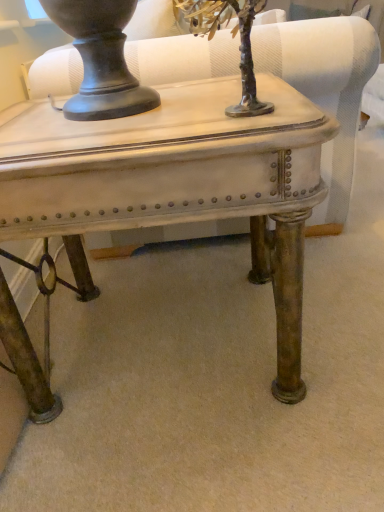
Question: Is the depth of matte white table at center greater than that of metallic silver tree at upper center?

Choices:
 (A) no
 (B) yes

Answer: (B)

Question: Considering the relative sizes of matte white table at center and metallic silver tree at upper center in the image provided, is matte white table at center wider than metallic silver tree at upper center?

Choices:
 (A) yes
 (B) no

Answer: (A)

Question: Can you see matte white table at center touching metallic silver tree at upper center?

Choices:
 (A) no
 (B) yes

Answer: (A)

Question: Considering the relative sizes of matte white table at center and metallic silver tree at upper center in the image provided, is matte white table at center taller than metallic silver tree at upper center?

Choices:
 (A) no
 (B) yes

Answer: (B)

Question: Is matte white table at center facing away from metallic silver tree at upper center?

Choices:
 (A) yes
 (B) no

Answer: (B)

Question: Would you say metallic silver tree at upper center is part of matte white table at center's contents?

Choices:
 (A) yes
 (B) no

Answer: (B)

Question: From the image's perspective, does metallic silver tree at upper center appear lower than matte white swivel chair at center?

Choices:
 (A) no
 (B) yes

Answer: (B)

Question: Considering the relative sizes of metallic silver tree at upper center and matte white swivel chair at center in the image provided, is metallic silver tree at upper center smaller than matte white swivel chair at center?

Choices:
 (A) no
 (B) yes

Answer: (B)

Question: Can you confirm if metallic silver tree at upper center is bigger than matte white swivel chair at center?

Choices:
 (A) no
 (B) yes

Answer: (A)

Question: Is metallic silver tree at upper center positioned with its back to matte white swivel chair at center?

Choices:
 (A) no
 (B) yes

Answer: (A)

Question: Is metallic silver tree at upper center next to matte white swivel chair at center and touching it?

Choices:
 (A) yes
 (B) no

Answer: (B)

Question: Is metallic silver tree at upper center located outside matte white swivel chair at center?

Choices:
 (A) no
 (B) yes

Answer: (B)

Question: Considering the relative sizes of metallic silver tree at upper center and matte white table at center in the image provided, is metallic silver tree at upper center shorter than matte white table at center?

Choices:
 (A) no
 (B) yes

Answer: (B)